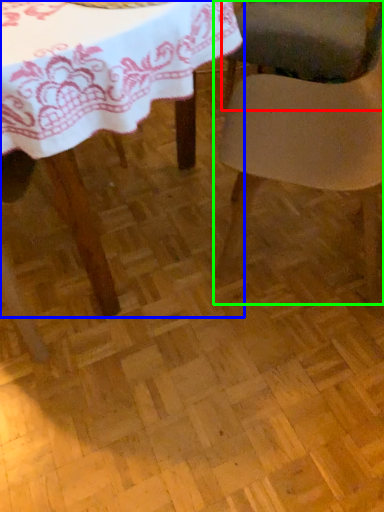
Question: Which object is the closest to the chair (highlighted by a red box)? Choose among these: table (highlighted by a blue box) or chair (highlighted by a green box).

Choices:
 (A) table
 (B) chair

Answer: (B)